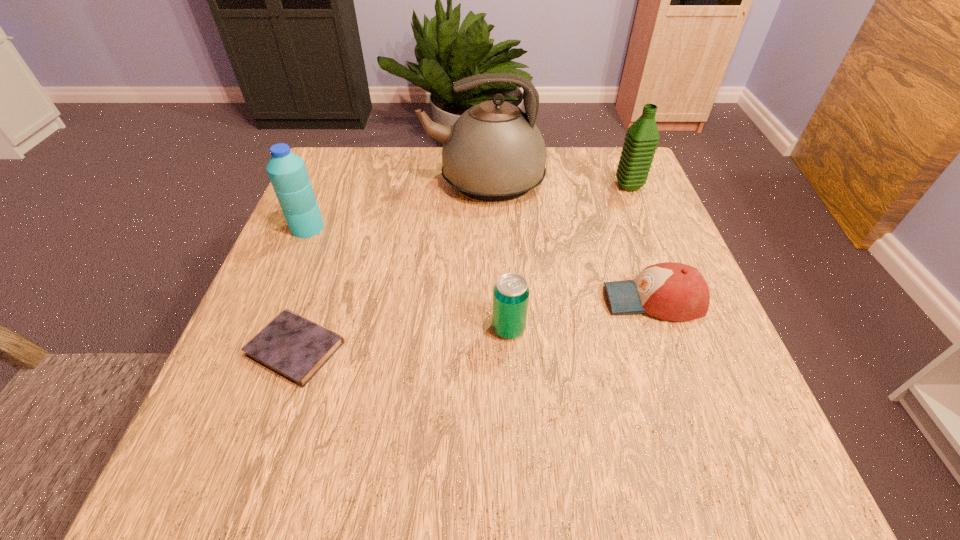
The height and width of the screenshot is (540, 960). In order to click on vacant space that's between the right water bottle and the kettle in this screenshot , I will do `click(556, 184)`.

Where is `vacant area between the beer can and the farther water bottle`? Image resolution: width=960 pixels, height=540 pixels. vacant area between the beer can and the farther water bottle is located at coordinates (568, 257).

What are the coordinates of `free space between the tallest object and the right water bottle` in the screenshot? It's located at (556, 184).

The image size is (960, 540). I want to click on free space between the third shortest object and the shortest object, so click(402, 339).

Locate an element on the screen. free space between the right water bottle and the left water bottle is located at coordinates (468, 207).

Where is `unoccupied position between the diary and the tallest object`? The width and height of the screenshot is (960, 540). unoccupied position between the diary and the tallest object is located at coordinates (390, 266).

Find the location of a particular element. free area in between the tallest object and the fourth tallest object is located at coordinates (496, 255).

Locate an element on the screen. Image resolution: width=960 pixels, height=540 pixels. free point between the shortest object and the kettle is located at coordinates point(390,266).

The width and height of the screenshot is (960, 540). Find the location of `vacant region between the left water bottle and the diary`. vacant region between the left water bottle and the diary is located at coordinates (301, 288).

Where is `free space between the right water bottle and the fourth tallest object`? The width and height of the screenshot is (960, 540). free space between the right water bottle and the fourth tallest object is located at coordinates click(568, 257).